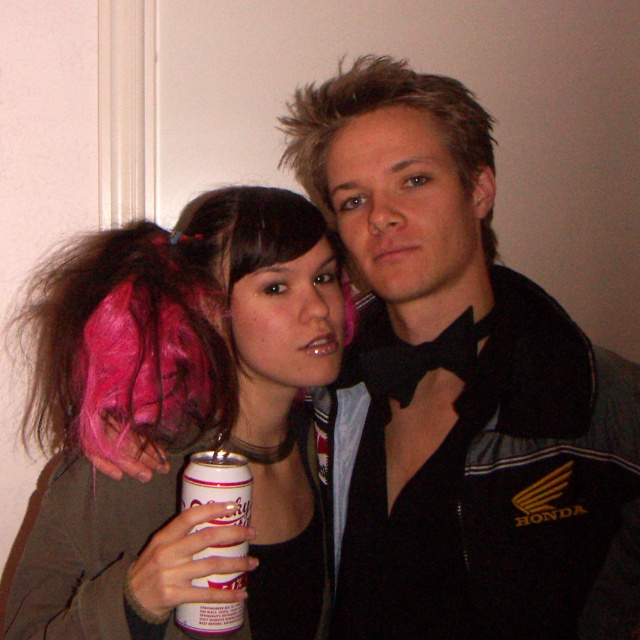
You are a photographer setting up a shoot. You need to adjust the lighting so that the black fabric bow tie at center and the pink fabric wig at left are both well lit. Which object should you focus the light on first to ensure both are properly illuminated?

The black fabric bow tie at center is in front of the pink fabric wig at left. Therefore, you should focus the light on the black fabric bow tie at center first to ensure it is properly illuminated, as it is closer to the camera and will require direct lighting before adjusting for the background object.

You are a photographer setting up for a group photo. You have two pink fabric wigs in the scene, one at the upper left and one at the left. You need to place a small microphone stand between them. The stand requires at least 4 centimeters of space to fit. Can the microphone stand fit between the pink fabric wig at upper left and the pink fabric wig at left?

The pink fabric wig at upper left and pink fabric wig at left are 5.27 centimeters apart from each other. Since the required space is 4 centimeters, the microphone stand can fit between them.

You are a photographer standing 60 inches away from the camera. You want to take a photo of the point at coordinates point (65, 618). Can you reach it without moving your camera?

The point (65, 618) is 30.66 inches away from the camera, so yes, you can reach it without moving the camera since it is within the 60 inches distance.